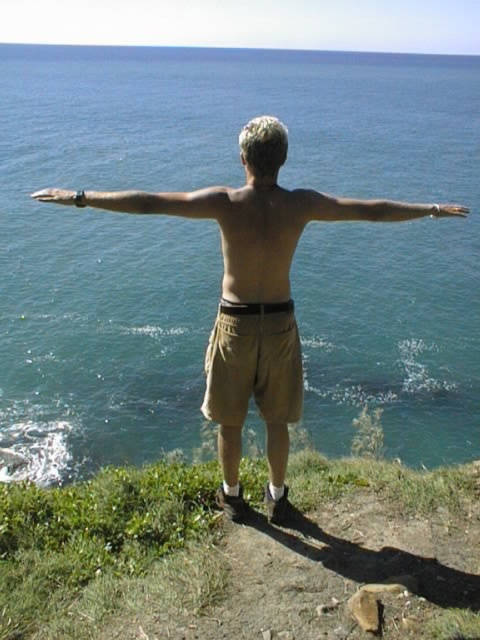
Who is lower down, matte black watch at upper left or matte black hand at upper left?

matte black watch at upper left

Between point (218, 212) and point (44, 195), which one is positioned in front?

Point (218, 212) is more forward.

In order to click on matte black watch at upper left in this screenshot , I will do `click(144, 202)`.

Who is positioned more to the right, blue water at center or khaki cotton shorts at center?

Positioned to the right is khaki cotton shorts at center.

Between blue water at center and khaki cotton shorts at center, which one has less height?

khaki cotton shorts at center is shorter.

Find the location of a particular element. The height and width of the screenshot is (640, 480). blue water at center is located at coordinates (218, 246).

Where is `blue water at center`? blue water at center is located at coordinates (218, 246).

Measure the distance between khaki cotton shorts at center and matte black hand at upper left.

khaki cotton shorts at center and matte black hand at upper left are 13.41 meters apart.

Locate an element on the screen. This screenshot has width=480, height=640. khaki cotton shorts at center is located at coordinates (252, 364).